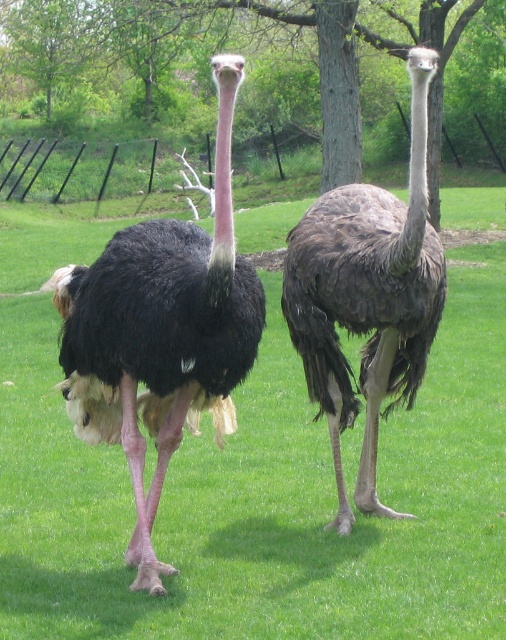
Does green grass at center appear over black feathered ostrich at center?

Yes.

Where is `green grass at center`? Image resolution: width=506 pixels, height=640 pixels. green grass at center is located at coordinates (265, 497).

Is black feathered ostrich at center shorter than dark brown feathers at center?

Yes, black feathered ostrich at center is shorter than dark brown feathers at center.

Is black feathered ostrich at center bigger than dark brown feathers at center?

Actually, black feathered ostrich at center might be smaller than dark brown feathers at center.

Looking at this image, who is more distant from viewer, [98,432] or [323,369]?

The point [323,369] is more distant.

I want to click on black feathered ostrich at center, so click(160, 333).

Between point (287, 381) and point (364, 381), which one is positioned behind?

The point (287, 381) is more distant.

Which is in front, point (417, 456) or point (334, 400)?

Positioned in front is point (334, 400).

Which is in front, point (363, 608) or point (438, 282)?

Point (363, 608) is more forward.

Locate an element on the screen. This screenshot has height=640, width=506. green grass at center is located at coordinates (265, 497).